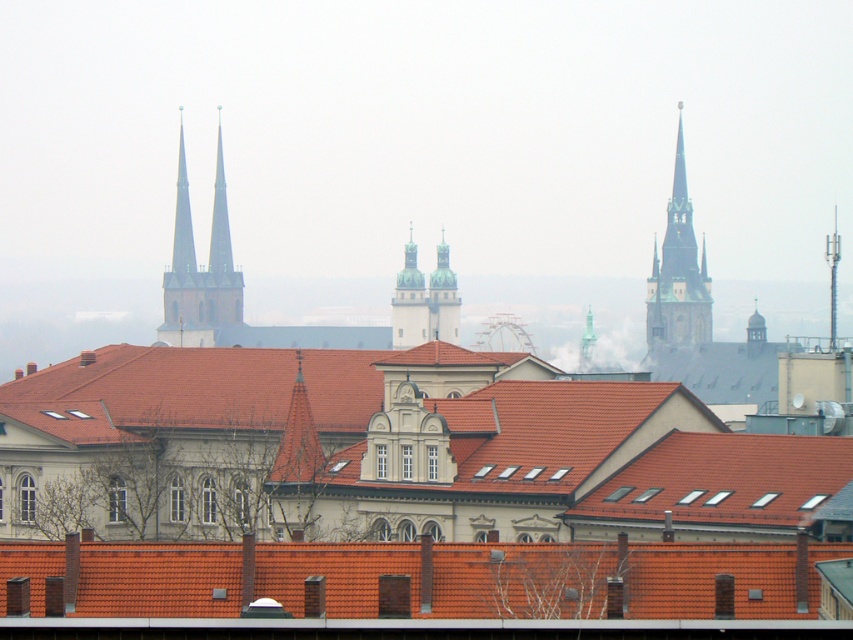
You are an architect planning to install a new light between the smooth stone towers at upper left and the smooth stone spire at upper left. The light requires a minimum of 7 meters of space between the two structures to be safely installed. Based on the scene, can the light be installed?

The smooth stone towers at upper left and smooth stone spire at upper left are 8.42 meters apart from each other. Since the required minimum space is 7 meters, the light can be installed safely between them.

Looking at this image, you are an architect analyzing the cityscape. You need to determine which of the two towers, the smooth stone towers at upper left or the smooth gray tower at center, has a greater width. Based on the scene, which one is wider?

The smooth stone towers at upper left is wider than the smooth gray tower at center.